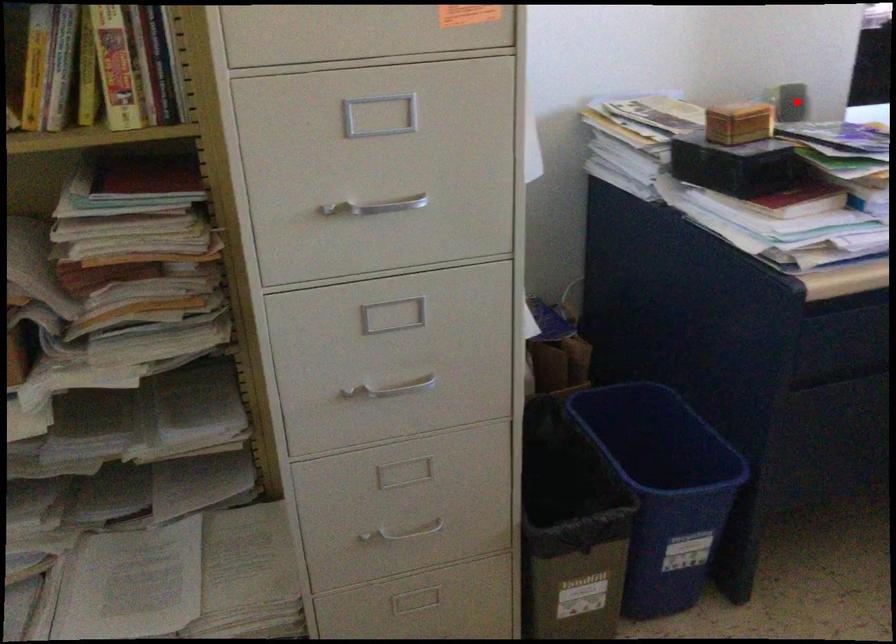
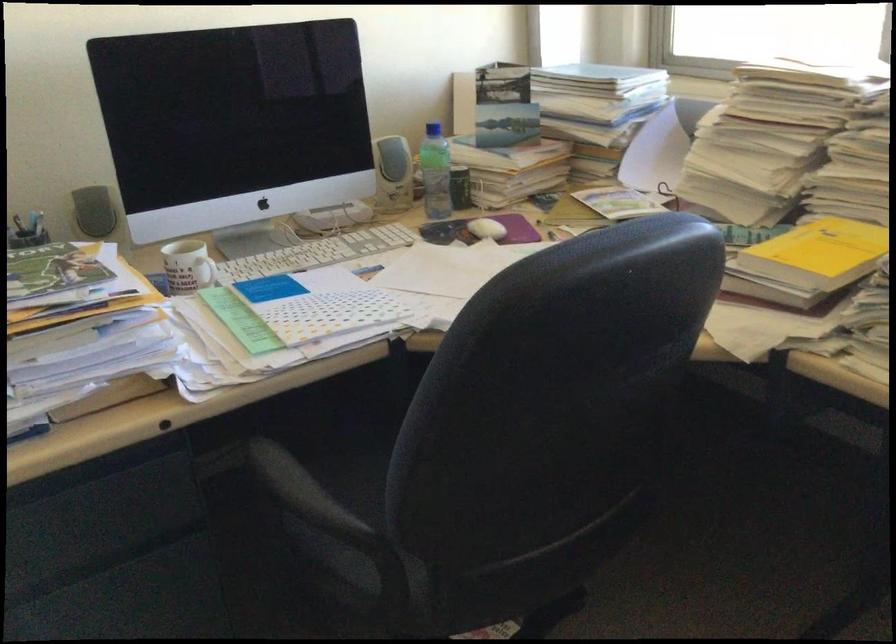
Question: A red point is marked in image1. In image2, is the corresponding 3D point closer to the camera or farther? Reply with the corresponding letter.

Choices:
 (A) The corresponding 3D point is closer.
 (B) The corresponding 3D point is farther.

Answer: (A)